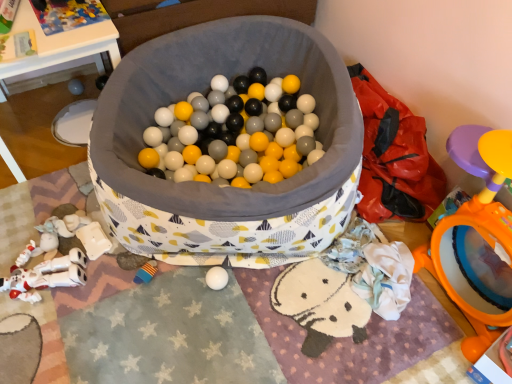
Identify the location of free spot to the left of soft plush toy at lower left, which appears as the first toy when ordered from the bottom. This screenshot has height=384, width=512. (101, 281).